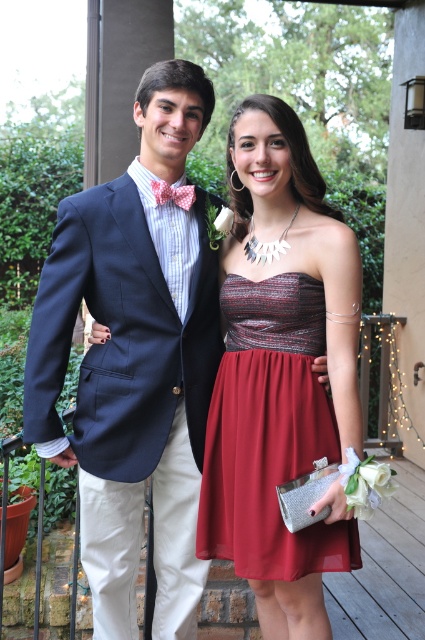
You are planning to take a photo of the shiny red chiffon dress at center and the pink dotted bow tie at upper center. Which object should you focus on first if you want to capture both in the same frame without moving the camera?

The shiny red chiffon dress at center is wider than the pink dotted bow tie at upper center, so you should focus on the shiny red chiffon dress at center first to ensure it fits within the frame.

You are a photographer holding a camera and want to take a photo of the matte black blazer at upper left. Based on the scene description, can you position yourself close enough to capture the entire blazer in the frame without moving the subject?

The matte black blazer at upper left and camera are 2.04 meters apart. Since the distance is more than sufficient for a photographer to capture the entire blazer in the frame without needing to move closer, the answer is yes.

Based on the coordinates provided, which object is located at point (x=135, y=360)?

The point (x=135, y=360) marks the location of the matte black blazer at upper left.